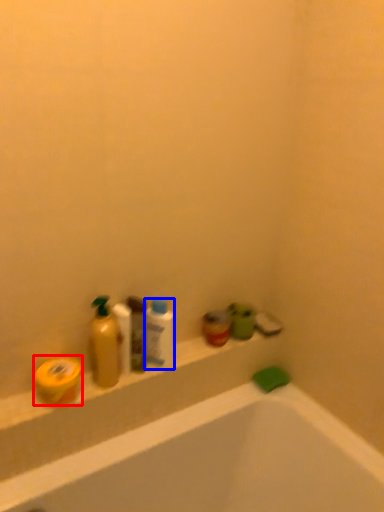
Question: Which object appears closest to the camera in this image, soap (highlighted by a red box) or mouthwash (highlighted by a blue box)?

Choices:
 (A) soap
 (B) mouthwash

Answer: (A)